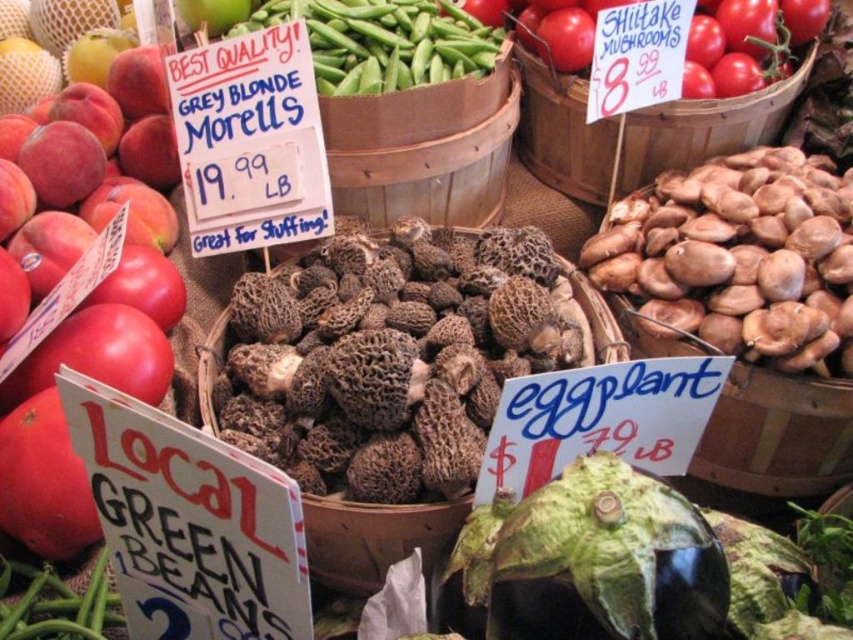
You are a chef preparing a dish and need to quickly grab both the black fuzzy mushrooms at center and the red matte tomatoes at upper right. Based on their positions in the farmers market scene, which one would you reach first without moving your position?

The black fuzzy mushrooms at center is in front of the red matte tomatoes at upper right, so you would reach the black fuzzy mushrooms at center first without moving your position.

From the picture: You are a chef preparing a dish that requires both black fuzzy mushrooms at center and red matte tomatoes at upper right. You need to place them on a shelf in your kitchen. Which object should you place lower to ensure they both fit on the shelf without one blocking the other?

The red matte tomatoes at upper right should be placed lower because the black fuzzy mushrooms at center are much taller, so placing the shorter tomatoes lower will prevent the mushrooms from blocking them.